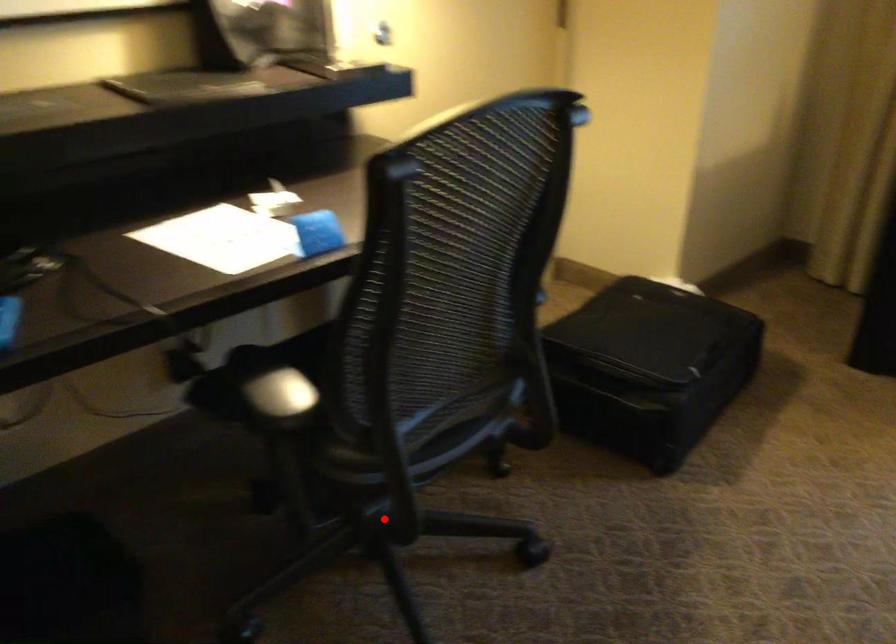
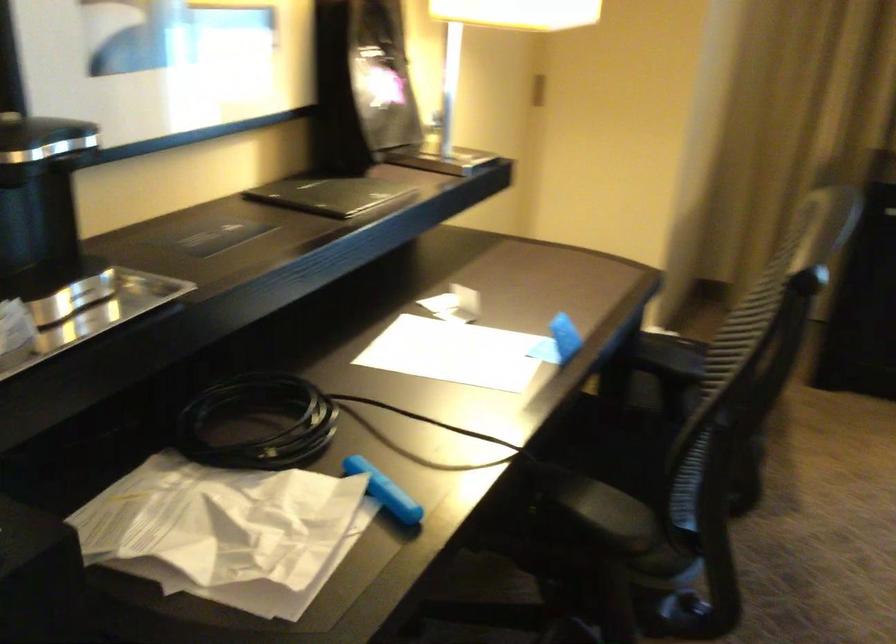
Find the pixel in the second image that matches the highlighted location in the first image.

(679, 614)